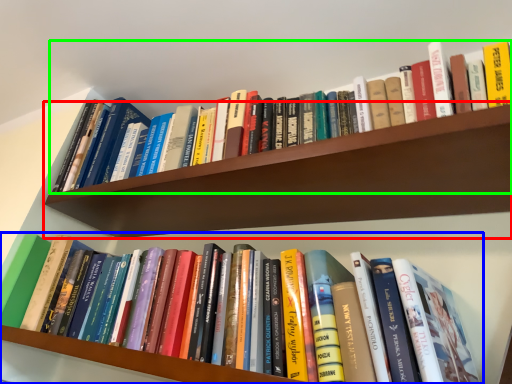
Question: Based on their relative distances, which object is nearer to shelf (highlighted by a red box)? Choose from book (highlighted by a blue box) and book (highlighted by a green box).

Choices:
 (A) book
 (B) book

Answer: (B)